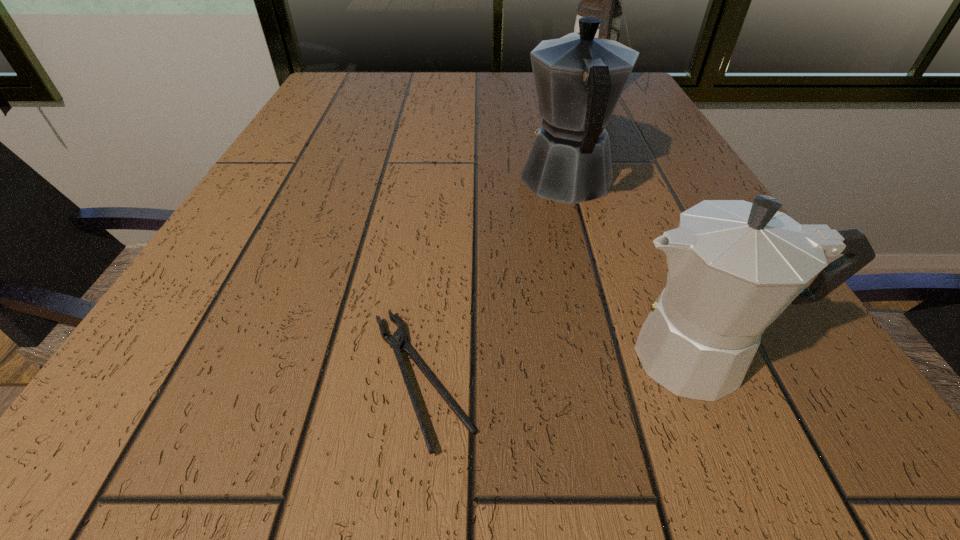
Find the location of a particular element. The width and height of the screenshot is (960, 540). the tallest object is located at coordinates (601, 0).

You are a GUI agent. You are given a task and a screenshot of the screen. Output one action in this format:
    pyautogui.click(x=<x>, y=<y>)
    Task: Click on the farthest object
    
    Given the screenshot: What is the action you would take?
    pyautogui.click(x=601, y=0)

At what (x,y) coordinates should I click in order to perform the action: click on the third shortest object. Please return your answer as a coordinate pair (x, y). Looking at the image, I should click on (579, 79).

Identify the location of the second farthest object. The height and width of the screenshot is (540, 960). (579, 79).

The width and height of the screenshot is (960, 540). Identify the location of the shorter coffeepot. (733, 266).

Find the location of `the nearer coffeepot`. the nearer coffeepot is located at coordinates (733, 266).

Where is `the shortest object`? Image resolution: width=960 pixels, height=540 pixels. the shortest object is located at coordinates (396, 341).

Where is `the leftmost object`? The height and width of the screenshot is (540, 960). the leftmost object is located at coordinates (396, 341).

The height and width of the screenshot is (540, 960). Identify the location of vacant area situated 0.200m on the front of the tallest object. (618, 154).

This screenshot has height=540, width=960. What are the coordinates of `free location located 0.150m at the spout of the third shortest object` in the screenshot? It's located at (550, 116).